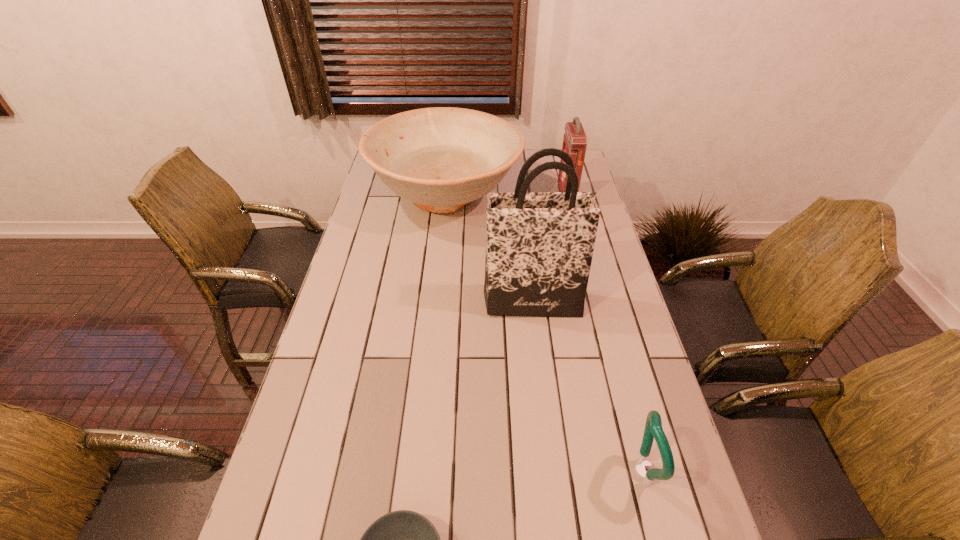
Locate an element on the screen. The width and height of the screenshot is (960, 540). free spot located 0.210m on the right of the third shortest object is located at coordinates (573, 195).

Find the location of `blank space located at the jaws of the bottle opener`. blank space located at the jaws of the bottle opener is located at coordinates coord(546,472).

Identify the location of free space located at the jaws of the bottle opener. This screenshot has height=540, width=960. (574, 472).

You are a GUI agent. You are given a task and a screenshot of the screen. Output one action in this format:
    pyautogui.click(x=<x>, y=<y>)
    Task: Click on the free spot located at the jaws of the bottle opener
    
    Given the screenshot: What is the action you would take?
    pyautogui.click(x=588, y=472)

At what (x,y) coordinates should I click in order to perform the action: click on object that is positioned at the far edge. Please return your answer as a coordinate pair (x, y). The image size is (960, 540). Looking at the image, I should click on (441, 158).

Identify the location of object located in the left edge section of the desktop. (441, 158).

You are a GUI agent. You are given a task and a screenshot of the screen. Output one action in this format:
    pyautogui.click(x=<x>, y=<y>)
    Task: Click on the shopping bag that is positioned at the right edge
    The image size is (960, 540).
    Given the screenshot: What is the action you would take?
    pyautogui.click(x=539, y=245)

Where is `the first-aid kit at the right edge`? the first-aid kit at the right edge is located at coordinates (574, 141).

Where is `bottle opener that is at the right edge`? Image resolution: width=960 pixels, height=540 pixels. bottle opener that is at the right edge is located at coordinates (653, 428).

The image size is (960, 540). Find the location of `object that is at the far left corner`. object that is at the far left corner is located at coordinates (441, 158).